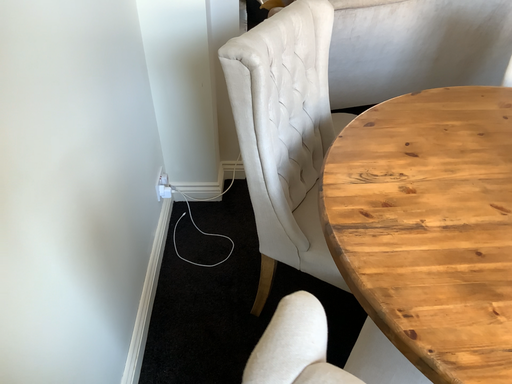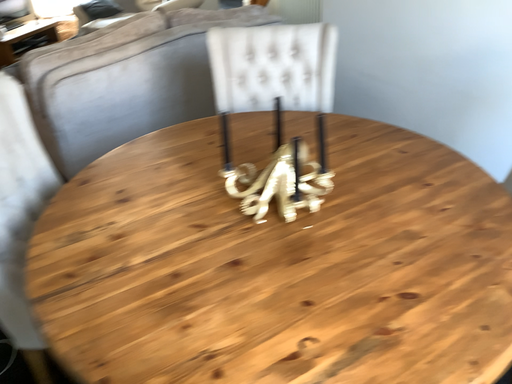
Question: How did the camera likely rotate when shooting the video?

Choices:
 (A) rotated downward
 (B) rotated upward

Answer: (B)